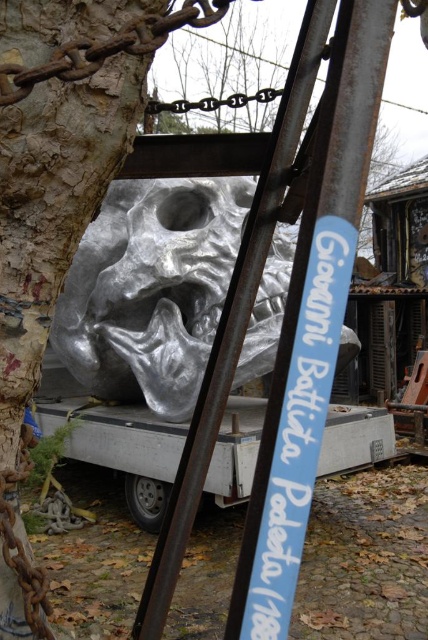
You are an art student analyzing the outdoor sculpture installation. You notice two central elements, the shiny silver mask at center and the brushed metal tree at center. Based on their positions, which one is located to the left?

The shiny silver mask at center is to the left of the brushed metal tree at center.

You are standing in front of the sculpture and want to touch both points on the sculpture. Which point should you reach for first, point at coordinate (184,236) or point at coordinate (166,61)?

You should reach for point at coordinate (184,236) first because it is closer to you than point at coordinate (166,61).